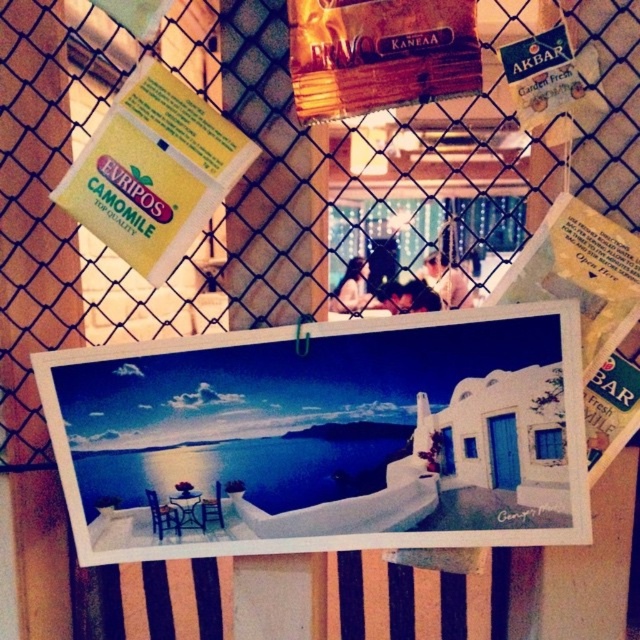
You are standing in front of the fence with items pinned to it. There are two points marked on the fence at coordinates point (403, 385) and point (140, 77). Which point is closer to you?

Point (403, 385) is further to the viewer than point (140, 77), so point (140, 77) is closer to you.

You are standing in front of the fence with the large coastal photograph and the EVRIPOS CAMOMILE card. You want to touch the point at coordinates (x=474, y=435). Can you reach it without moving closer to the fence?

The point at coordinates (x=474, y=435) is 36.76 inches from the camera, so if you are standing at the camera position, you would need to extend your arm about 36.76 inches to reach it. Since the average human arm length is around 25 inches, you would not be able to reach it without moving closer to the fence.

You are a tourist looking for a place to stay. You see the white matte postcard at center and the yellow paper at upper left pinned on the fence. Which one is taller?

The white matte postcard at center is taller than the yellow paper at upper left.